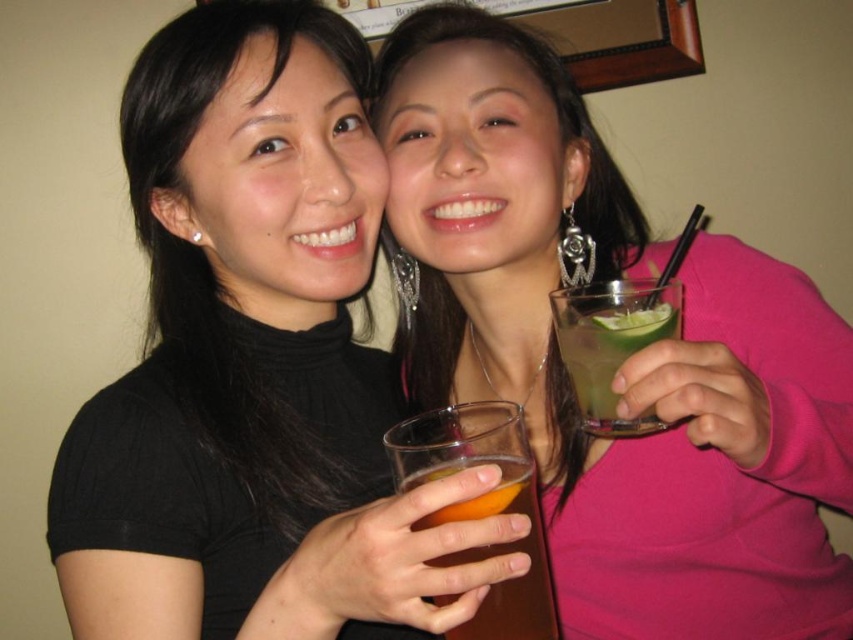
Question: Is matte black turtleneck at upper left smaller than green translucent glass at upper right?

Choices:
 (A) yes
 (B) no

Answer: (B)

Question: Considering the relative positions of matte black top at center and green translucent glass at upper right in the image provided, where is matte black top at center located with respect to green translucent glass at upper right?

Choices:
 (A) right
 (B) left

Answer: (A)

Question: Which point is farther to the camera?

Choices:
 (A) (259, 470)
 (B) (838, 611)
 (C) (503, 468)
 (D) (613, 436)

Answer: (B)

Question: Which point is farther to the camera?

Choices:
 (A) green translucent glass at upper right
 (B) translucent glass at center

Answer: (A)

Question: Is matte black turtleneck at upper left bigger than translucent glass at center?

Choices:
 (A) yes
 (B) no

Answer: (A)

Question: Which of the following is the farthest from the observer?

Choices:
 (A) (589, 529)
 (B) (526, 605)
 (C) (566, 346)
 (D) (134, 147)

Answer: (A)